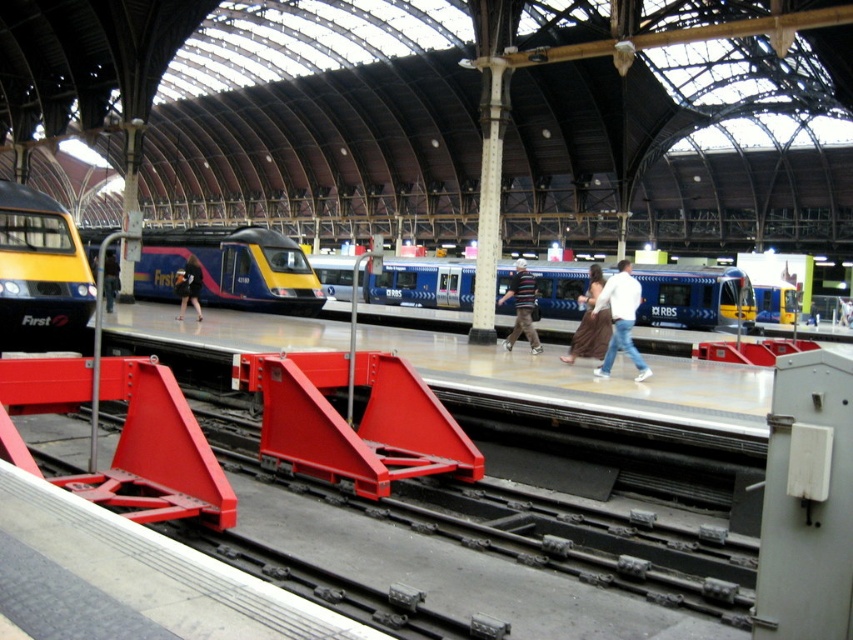
Question: Among these points, which one is farthest from the camera?

Choices:
 (A) (611, 316)
 (B) (605, 321)
 (C) (664, 308)
 (D) (180, 285)

Answer: (C)

Question: Which object is positioned farthest from the yellow and blue metal train at center?

Choices:
 (A) metallic red platform at center
 (B) striped sweater at center
 (C) dark brown leather jacket at center
 (D) yellow matte train at left

Answer: (B)

Question: Estimate the real-world distances between objects in this image. Which object is farther from the denim jeans at center?

Choices:
 (A) brown fabric skirt at center
 (B) yellow matte train at left
 (C) striped sweater at center
 (D) blue metallic train at center

Answer: (D)

Question: Can you confirm if striped sweater at center is positioned to the right of dark brown leather jacket at center?

Choices:
 (A) yes
 (B) no

Answer: (A)

Question: Is yellow and blue metal train at center wider than striped sweater at center?

Choices:
 (A) no
 (B) yes

Answer: (B)

Question: Can you confirm if yellow matte train at left is positioned to the right of striped sweater at center?

Choices:
 (A) yes
 (B) no

Answer: (B)